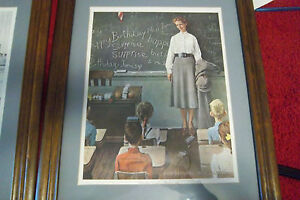
The height and width of the screenshot is (200, 300). I want to click on desks, so click(x=105, y=91), click(x=165, y=134), click(x=203, y=133), click(x=202, y=157), click(x=155, y=156), click(x=100, y=128), click(x=91, y=153).